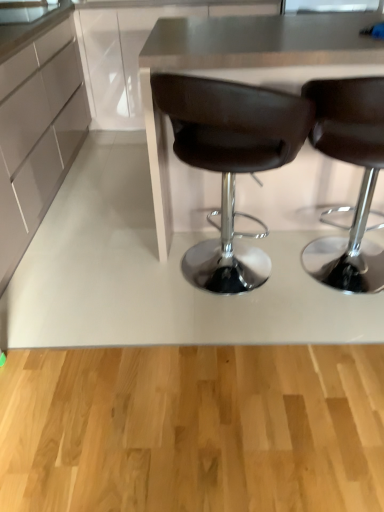
Measure the distance between point (180,110) and camera.

Point (180,110) is 1.38 meters away from camera.

What do you see at coordinates (244, 69) in the screenshot?
I see `metallic gray table at center` at bounding box center [244, 69].

Where is `brown leather chair at center, which is the 1th chair from right to left`? brown leather chair at center, which is the 1th chair from right to left is located at coordinates (352, 163).

How much space does brown leather chair at center, placed as the 2th chair when sorted from left to right, occupy vertically?

It is 35.15 inches.

The width and height of the screenshot is (384, 512). What are the coordinates of `matte white cabinet at left` in the screenshot? It's located at point(37,133).

The width and height of the screenshot is (384, 512). I want to click on brown leather chair at center, placed as the second chair when sorted from right to left, so click(230, 161).

Is brown leather chair at center, placed as the 2th chair when sorted from left to right, positioned before metallic gray table at center?

Yes, brown leather chair at center, placed as the 2th chair when sorted from left to right, is closer to the viewer.

From the image's perspective, which is below, brown leather chair at center, placed as the 2th chair when sorted from left to right, or metallic gray table at center?

brown leather chair at center, placed as the 2th chair when sorted from left to right, is shown below in the image.

Is brown leather chair at center, placed as the 2th chair when sorted from left to right, oriented away from metallic gray table at center?

brown leather chair at center, placed as the 2th chair when sorted from left to right, is not turned away from metallic gray table at center.

From a real-world perspective, does brown leather chair at center, placed as the 2th chair when sorted from left to right, sit lower than matte white cabinet at left?

Yes, from a real-world perspective, brown leather chair at center, placed as the 2th chair when sorted from left to right, is below matte white cabinet at left.

Is brown leather chair at center, which is the 1th chair from right to left, in front of or behind matte white cabinet at left in the image?

In the image, brown leather chair at center, which is the 1th chair from right to left, appears in front of matte white cabinet at left.

Can you see brown leather chair at center, which is the 1th chair from right to left, touching matte white cabinet at left?

They are not placed beside each other.

Who is shorter, metallic gray table at center or matte white cabinet at left?

matte white cabinet at left.

Choose the correct answer: Is metallic gray table at center inside matte white cabinet at left or outside it?

The correct answer is: outside.

Between point (317, 42) and point (1, 182), which one is positioned in front?

The point (317, 42) is closer to the camera.

Which object is positioned more to the right, brown leather chair at center, placed as the first chair when sorted from left to right, or metallic gray table at center?

Positioned to the right is metallic gray table at center.

Can you confirm if brown leather chair at center, placed as the second chair when sorted from right to left, is bigger than metallic gray table at center?

Actually, brown leather chair at center, placed as the second chair when sorted from right to left, might be smaller than metallic gray table at center.

In terms of width, does brown leather chair at center, placed as the first chair when sorted from left to right, look wider or thinner when compared to metallic gray table at center?

Considering their sizes, brown leather chair at center, placed as the first chair when sorted from left to right, looks slimmer than metallic gray table at center.

From the image's perspective, which one is positioned lower, brown leather chair at center, placed as the second chair when sorted from right to left, or metallic gray table at center?

brown leather chair at center, placed as the second chair when sorted from right to left.

Looking at their sizes, would you say brown leather chair at center, placed as the first chair when sorted from left to right, is wider or thinner than matte white cabinet at left?

brown leather chair at center, placed as the first chair when sorted from left to right, is thinner than matte white cabinet at left.

From a real-world perspective, between brown leather chair at center, placed as the first chair when sorted from left to right, and matte white cabinet at left, who is vertically higher?

matte white cabinet at left.

Is brown leather chair at center, placed as the first chair when sorted from left to right, aimed at matte white cabinet at left?

No, brown leather chair at center, placed as the first chair when sorted from left to right, does not turn towards matte white cabinet at left.

How many degrees apart are the facing directions of brown leather chair at center, placed as the second chair when sorted from right to left, and matte white cabinet at left?

The facing directions of brown leather chair at center, placed as the second chair when sorted from right to left, and matte white cabinet at left are 90 degrees apart.

From the image's perspective, who appears lower, brown leather chair at center, placed as the 2th chair when sorted from left to right, or brown leather chair at center, placed as the second chair when sorted from right to left?

brown leather chair at center, placed as the 2th chair when sorted from left to right, appears lower in the image.

From a real-world perspective, which object rests below the other?

From a 3D spatial view, brown leather chair at center, placed as the second chair when sorted from right to left, is below.

Can you confirm if brown leather chair at center, which is the 1th chair from right to left, is wider than brown leather chair at center, placed as the first chair when sorted from left to right?

Incorrect, the width of brown leather chair at center, which is the 1th chair from right to left, does not surpass that of brown leather chair at center, placed as the first chair when sorted from left to right.

From the image's perspective, is metallic gray table at center located above or below brown leather chair at center, which is the 1th chair from right to left?

Clearly, from the image's perspective, metallic gray table at center is above brown leather chair at center, which is the 1th chair from right to left.

Is metallic gray table at center turned away from brown leather chair at center, placed as the 2th chair when sorted from left to right?

No.

In the scene shown: Can you confirm if metallic gray table at center is wider than brown leather chair at center, which is the 1th chair from right to left?

Yes.

How far apart are metallic gray table at center and brown leather chair at center, placed as the 2th chair when sorted from left to right?

A distance of 30.85 inches exists between metallic gray table at center and brown leather chair at center, placed as the 2th chair when sorted from left to right.

Where is `chair that is the 2nd one when counting forward from the metallic gray table at center`? chair that is the 2nd one when counting forward from the metallic gray table at center is located at coordinates (352, 163).

The width and height of the screenshot is (384, 512). I want to click on cabinetry that appears on the left of brown leather chair at center, which is the 1th chair from right to left, so click(x=37, y=133).

Considering their positions, is metallic gray table at center positioned further to brown leather chair at center, placed as the first chair when sorted from left to right, than brown leather chair at center, placed as the 2th chair when sorted from left to right?

The object further to brown leather chair at center, placed as the first chair when sorted from left to right, is brown leather chair at center, placed as the 2th chair when sorted from left to right.

Which object lies nearer to the anchor point metallic gray table at center, brown leather chair at center, which is the 1th chair from right to left, or matte white cabinet at left?

Based on the image, brown leather chair at center, which is the 1th chair from right to left, appears to be nearer to metallic gray table at center.

Considering their positions, is metallic gray table at center positioned further to matte white cabinet at left than brown leather chair at center, placed as the 2th chair when sorted from left to right?

brown leather chair at center, placed as the 2th chair when sorted from left to right.

Looking at the image, which one is located closer to brown leather chair at center, placed as the second chair when sorted from right to left, matte white cabinet at left or brown leather chair at center, which is the 1th chair from right to left?

brown leather chair at center, which is the 1th chair from right to left, is positioned closer to the anchor brown leather chair at center, placed as the second chair when sorted from right to left.

Based on their spatial positions, is matte white cabinet at left or brown leather chair at center, placed as the second chair when sorted from right to left, closer to brown leather chair at center, which is the 1th chair from right to left?

brown leather chair at center, placed as the second chair when sorted from right to left, is positioned closer to the anchor brown leather chair at center, which is the 1th chair from right to left.

Considering their positions, is brown leather chair at center, which is the 1th chair from right to left, positioned further to brown leather chair at center, placed as the first chair when sorted from left to right, than metallic gray table at center?

brown leather chair at center, which is the 1th chair from right to left, lies further to brown leather chair at center, placed as the first chair when sorted from left to right, than the other object.

Which object lies further to the anchor point metallic gray table at center, brown leather chair at center, which is the 1th chair from right to left, or brown leather chair at center, placed as the first chair when sorted from left to right?

brown leather chair at center, which is the 1th chair from right to left, is further to metallic gray table at center.

Estimate the real-world distances between objects in this image. Which object is closer to matte white cabinet at left, brown leather chair at center, placed as the 2th chair when sorted from left to right, or brown leather chair at center, placed as the second chair when sorted from right to left?

brown leather chair at center, placed as the second chair when sorted from right to left, lies closer to matte white cabinet at left than the other object.

Image resolution: width=384 pixels, height=512 pixels. I want to click on table between matte white cabinet at left and brown leather chair at center, placed as the 2th chair when sorted from left to right, from left to right, so click(244, 69).

The height and width of the screenshot is (512, 384). Identify the location of table between brown leather chair at center, placed as the second chair when sorted from right to left, and brown leather chair at center, which is the 1th chair from right to left. (244, 69).

Identify the location of chair located between matte white cabinet at left and brown leather chair at center, which is the 1th chair from right to left, in the left-right direction. (230, 161).

I want to click on chair between matte white cabinet at left and metallic gray table at center from left to right, so click(230, 161).